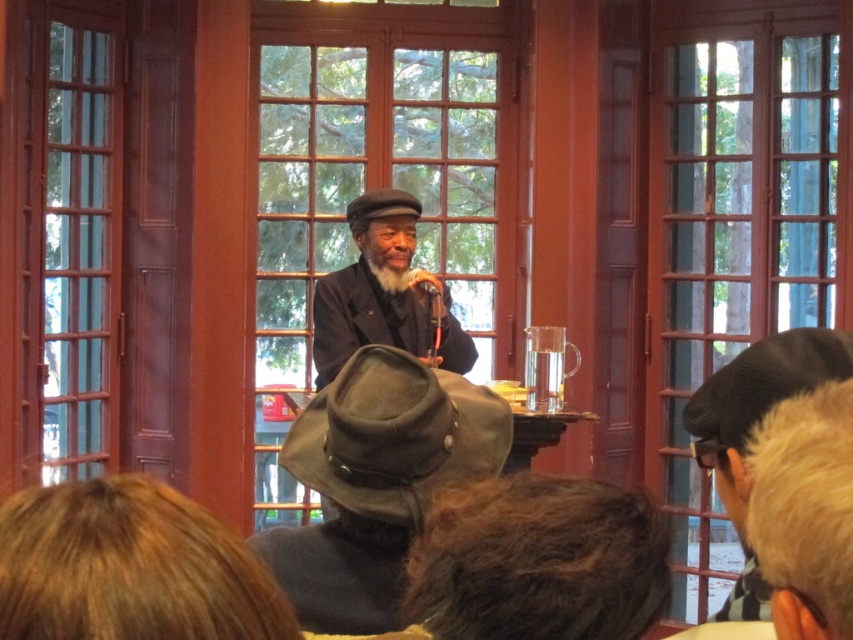
Question: Which point appears farthest from the camera in this image?

Choices:
 (A) (x=328, y=324)
 (B) (x=410, y=273)

Answer: (B)

Question: Which point is farther to the camera?

Choices:
 (A) (386, 234)
 (B) (427, 285)

Answer: (A)

Question: Is matte black hat at center to the right of matte black microphone at center from the viewer's perspective?

Choices:
 (A) yes
 (B) no

Answer: (B)

Question: Does matte black hat at center lie in front of matte black microphone at center?

Choices:
 (A) yes
 (B) no

Answer: (A)

Question: Considering the relative positions of matte black hat at center and matte black microphone at center in the image provided, where is matte black hat at center located with respect to matte black microphone at center?

Choices:
 (A) below
 (B) above

Answer: (A)